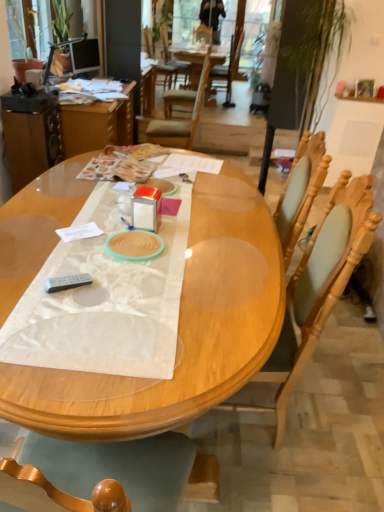
The width and height of the screenshot is (384, 512). Identify the location of spots to the right of gray matte remote control at lower left. (125, 291).